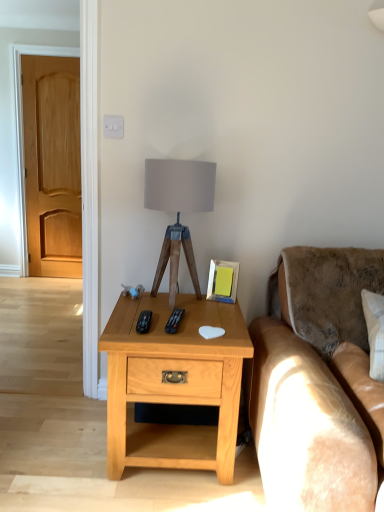
Measure the distance between point (x=173, y=436) and camera.

Point (x=173, y=436) is 5.74 feet away from camera.

Measure the distance between brown plush couch at right and camera.

The distance of brown plush couch at right from camera is 3.69 feet.

Measure the distance between point (157, 162) and camera.

Point (157, 162) and camera are 5.47 feet apart from each other.

The width and height of the screenshot is (384, 512). What do you see at coordinates (52, 164) in the screenshot?
I see `light brown wood door at left` at bounding box center [52, 164].

The image size is (384, 512). What are the coordinates of `metallic silver picture frame at upper right` in the screenshot? It's located at (223, 281).

Locate an element on the screen. Image resolution: width=384 pixels, height=512 pixels. light wood/texturedesk at center is located at coordinates [x=174, y=384].

From the picture: Which of these two, metallic silver picture frame at upper right or black plastic remote at center, the 2th remote when ordered from left to right, is bigger?

metallic silver picture frame at upper right.

Does metallic silver picture frame at upper right have a lesser height compared to black plastic remote at center, the 2th remote when ordered from left to right?

No.

Is metallic silver picture frame at upper right wider or thinner than black plastic remote at center, the 2th remote when ordered from left to right?

In the image, metallic silver picture frame at upper right appears to be more narrow than black plastic remote at center, the 2th remote when ordered from left to right.

Is metallic silver picture frame at upper right oriented towards black plastic remote at center, the 2th remote when ordered from left to right?

Yes, metallic silver picture frame at upper right faces towards black plastic remote at center, the 2th remote when ordered from left to right.

Is metallic silver picture frame at upper right a part of black plastic remote at center, the 1th remote positioned from the right?

That's incorrect, metallic silver picture frame at upper right is not inside black plastic remote at center, the 1th remote positioned from the right.

From a real-world perspective, is black plastic remote at center, the 1th remote positioned from the right, located beneath metallic silver picture frame at upper right?

Yes, from a real-world perspective, black plastic remote at center, the 1th remote positioned from the right, is beneath metallic silver picture frame at upper right.

Is black plastic remote at center, the 2th remote when ordered from left to right, facing away from metallic silver picture frame at upper right?

No, black plastic remote at center, the 2th remote when ordered from left to right,'s orientation is not away from metallic silver picture frame at upper right.

Is black plastic remote at center, the 1th remote positioned from the right, smaller than metallic silver picture frame at upper right?

Yes, black plastic remote at center, the 1th remote positioned from the right, is smaller than metallic silver picture frame at upper right.

From the image's perspective, between metallic silver picture frame at upper right and light brown wood door at left, who is located below?

From the image's view, metallic silver picture frame at upper right is below.

Consider the image. From a real-world perspective, is metallic silver picture frame at upper right below light brown wood door at left?

Indeed, from a real-world perspective, metallic silver picture frame at upper right is positioned beneath light brown wood door at left.

Visually, is metallic silver picture frame at upper right positioned to the left or to the right of light brown wood door at left?

In the image, metallic silver picture frame at upper right appears on the right side of light brown wood door at left.

Are metallic silver picture frame at upper right and light brown wood door at left far apart?

Yes, metallic silver picture frame at upper right and light brown wood door at left are quite far apart.

Visually, is light brown wood door at left positioned to the left or to the right of black plastic remote at center, the 2th remote viewed from the right?

Clearly, light brown wood door at left is on the left of black plastic remote at center, the 2th remote viewed from the right, in the image.

From a real-world perspective, is light brown wood door at left below black plastic remote at center, the 2th remote viewed from the right?

No, from a real-world perspective, light brown wood door at left is not below black plastic remote at center, the 2th remote viewed from the right.

Between light brown wood door at left and black plastic remote at center, the 1th remote viewed from the left, which one is positioned behind?

light brown wood door at left is more distant.

Is black plastic remote at center, the 2th remote viewed from the right, at the back of light brown wood door at left?

No, black plastic remote at center, the 2th remote viewed from the right, is not at the back of light brown wood door at left.

Which is closer, (x=194, y=161) or (x=173, y=324)?

Clearly, point (x=194, y=161) is more distant from the camera than point (x=173, y=324).

Is matte gray fabric at center in front of or behind black plastic remote at center, the 1th remote positioned from the right, in the image?

Visually, matte gray fabric at center is located behind black plastic remote at center, the 1th remote positioned from the right.

From the image's perspective, count 1st remotes downward from the matte gray fabric at center and point to it. Please provide its 2D coordinates.

[(174, 321)]

Relative to light wood/texturedesk at center, is black plastic remote at center, the 2th remote viewed from the right, in front or behind?

Visually, black plastic remote at center, the 2th remote viewed from the right, is located behind light wood/texturedesk at center.

Is black plastic remote at center, the 2th remote viewed from the right, wider than light wood/texturedesk at center?

In fact, black plastic remote at center, the 2th remote viewed from the right, might be narrower than light wood/texturedesk at center.

Considering the positions of points (151, 312) and (136, 305), is point (151, 312) closer to camera compared to point (136, 305)?

That is True.

From a real-world perspective, between black plastic remote at center, the 1th remote viewed from the left, and light wood/texturedesk at center, who is vertically lower?

In real-world perspective, light wood/texturedesk at center is lower.

From the image's perspective, which object appears higher, matte gray fabric at center or black plastic remote at center, the 2th remote viewed from the right?

From the image's view, matte gray fabric at center is above.

Is matte gray fabric at center taller or shorter than black plastic remote at center, the 1th remote viewed from the left?

In the image, matte gray fabric at center appears to be taller than black plastic remote at center, the 1th remote viewed from the left.

Which of these two, matte gray fabric at center or black plastic remote at center, the 2th remote viewed from the right, is thinner?

With smaller width is black plastic remote at center, the 2th remote viewed from the right.

Is matte gray fabric at center far away from black plastic remote at center, the 2th remote viewed from the right?

That's not correct — matte gray fabric at center is a little close to black plastic remote at center, the 2th remote viewed from the right.

Which remote is the 1st one when counting from the front of the metallic silver picture frame at upper right? Please provide its 2D coordinates.

[(174, 321)]

I want to click on remote that is the 1st one when counting leftward from the metallic silver picture frame at upper right, so click(x=174, y=321).

Considering their positions, is brown plush couch at right positioned further to matte gray fabric at center than black plastic remote at center, the 2th remote viewed from the right?

brown plush couch at right.

Looking at the image, which one is located closer to metallic silver picture frame at upper right, black plastic remote at center, the 1th remote viewed from the left, or light wood/texturedesk at center?

light wood/texturedesk at center is positioned closer to the anchor metallic silver picture frame at upper right.

Looking at the image, which one is located closer to metallic silver picture frame at upper right, black plastic remote at center, the 2th remote viewed from the right, or black plastic remote at center, the 1th remote positioned from the right?

black plastic remote at center, the 1th remote positioned from the right, lies closer to metallic silver picture frame at upper right than the other object.

Which object lies nearer to the anchor point matte gray fabric at center, light wood/texturedesk at center or black plastic remote at center, the 1th remote positioned from the right?

Based on the image, light wood/texturedesk at center appears to be nearer to matte gray fabric at center.

From the image, which object appears to be nearer to brown plush couch at right, matte gray fabric at center or light brown wood door at left?

The object closer to brown plush couch at right is matte gray fabric at center.

When comparing their distances from light brown wood door at left, does light wood/texturedesk at center or black plastic remote at center, the 2th remote when ordered from left to right, seem closer?

light wood/texturedesk at center.

Based on their spatial positions, is matte gray fabric at center or black plastic remote at center, the 2th remote when ordered from left to right, further from brown plush couch at right?

Based on the image, matte gray fabric at center appears to be further to brown plush couch at right.

Based on their spatial positions, is light brown wood door at left or black plastic remote at center, the 2th remote viewed from the right, closer to brown plush couch at right?

black plastic remote at center, the 2th remote viewed from the right, is positioned closer to the anchor brown plush couch at right.

Find the location of a particular element. Image resolution: width=384 pixels, height=512 pixels. table lamp located between light wood/texturedesk at center and brown plush couch at right in the left-right direction is located at coordinates (178, 210).

Find the location of a particular element. This screenshot has height=512, width=384. remote between light wood/texturedesk at center and brown plush couch at right in the horizontal direction is located at coordinates (174, 321).

You are a GUI agent. You are given a task and a screenshot of the screen. Output one action in this format:
    pyautogui.click(x=<x>, y=<y>)
    Task: Click on the desk located between black plastic remote at center, the 1th remote viewed from the left, and brown plush couch at right in the left-right direction
    The image size is (384, 512).
    Given the screenshot: What is the action you would take?
    pyautogui.click(x=174, y=384)

The image size is (384, 512). Identify the location of table lamp situated between black plastic remote at center, the 2th remote when ordered from left to right, and brown plush couch at right from left to right. (178, 210).